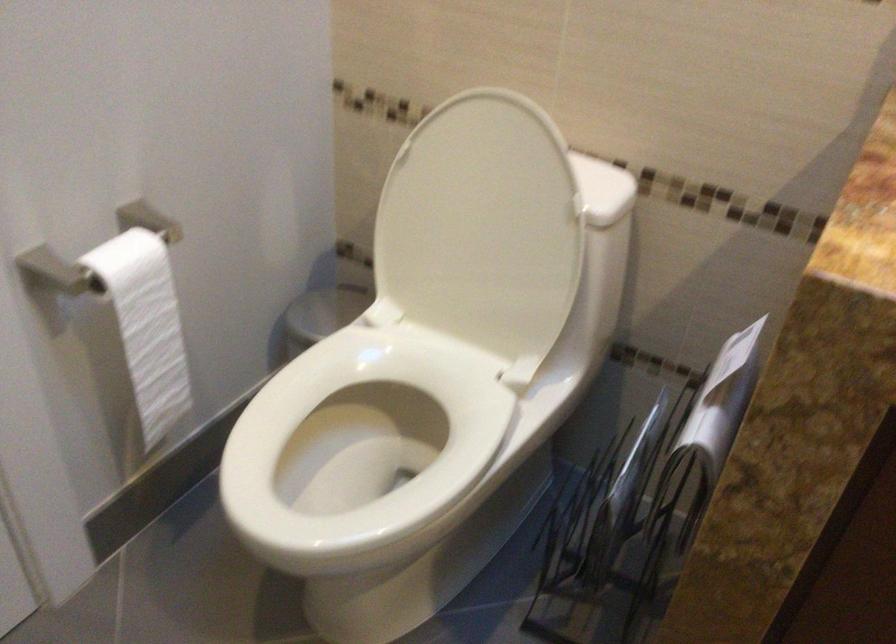
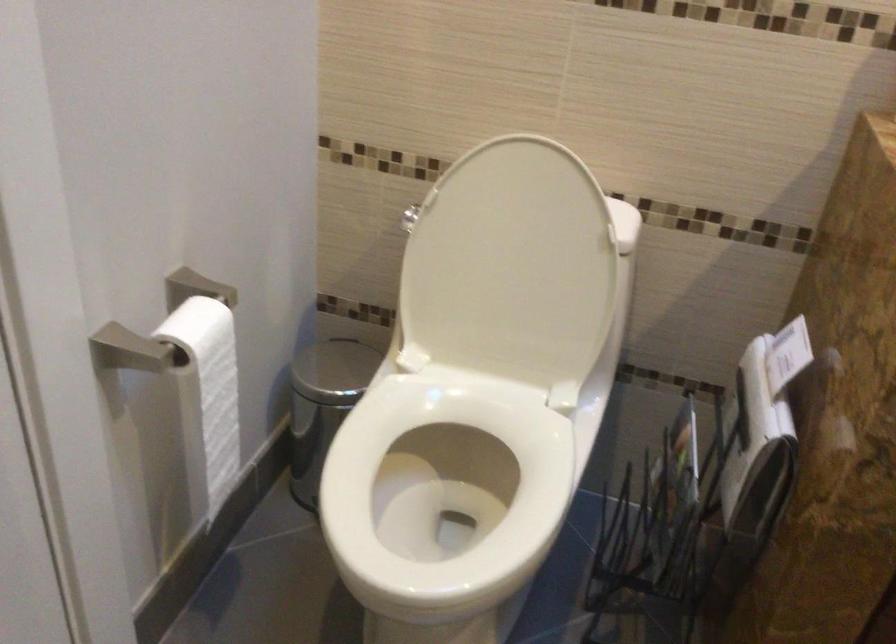
Question: Which direction would the cameraman need to move to produce the second image? Reply with the corresponding letter.

Choices:
 (A) Left
 (B) Right
 (C) Forward
 (D) Backward

Answer: (A)